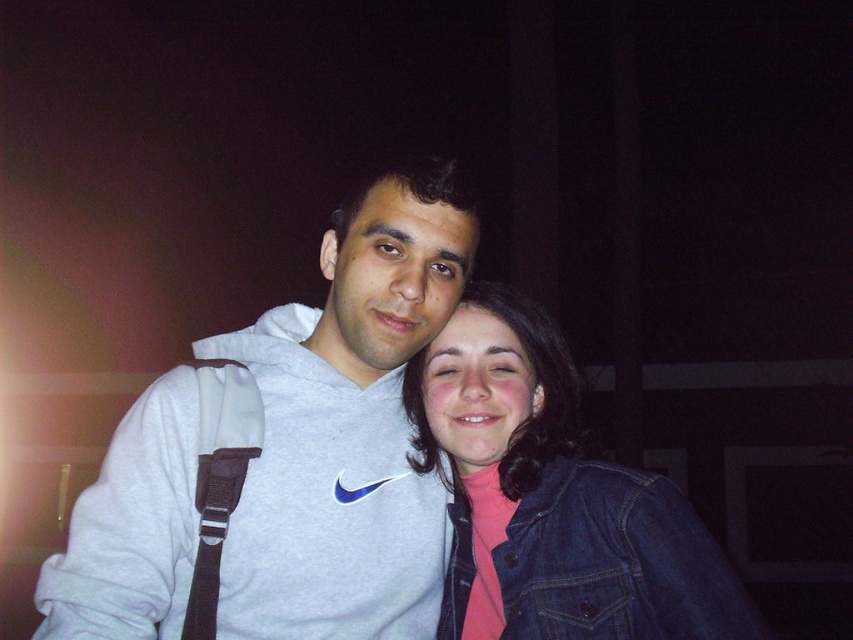
You are a photographer trying to decide where to place a small decorative lamp in the scene. You want the lamp to be positioned between the gray sweatshirt at center and the denim jacket at lower right. Considering their sizes, which object should the lamp be closer to?

The gray sweatshirt at center is bigger than the denim jacket at lower right, so the lamp should be placed closer to the denim jacket at lower right to balance the visual weight between the two objects.

You are trying to locate the gray sweatshirt at center in the image. According to the coordinates provided, where exactly is it positioned?

The gray sweatshirt at center is located at the 2D coordinates point (467,481).

You are a photographer trying to focus on the gray sweatshirt at center. The camera has a focus point at coordinates point (x=467, y=481). Is this focus point correctly positioned to capture the gray sweatshirt at center?

Yes, the focus point at coordinates point (x=467, y=481) is correctly positioned because the Objects Description states that this point corresponds to the gray sweatshirt at center.